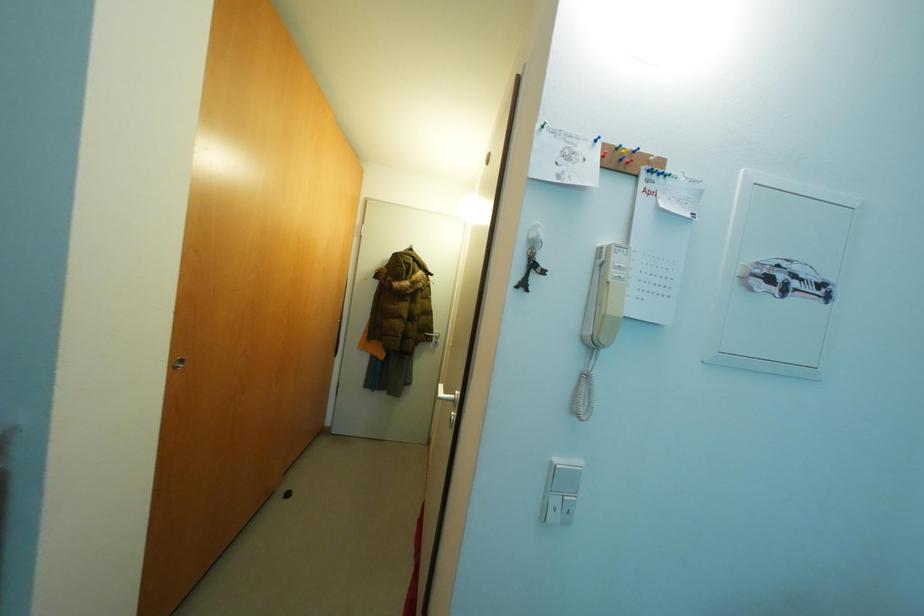
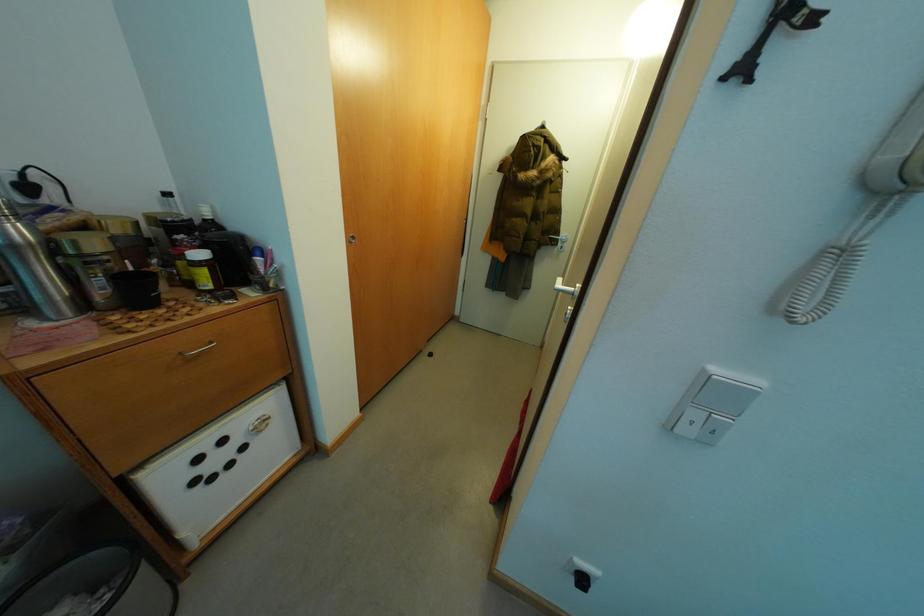
First-person continuous shooting, in which direction is the camera rotating?

The rotation direction of the camera is left-down.